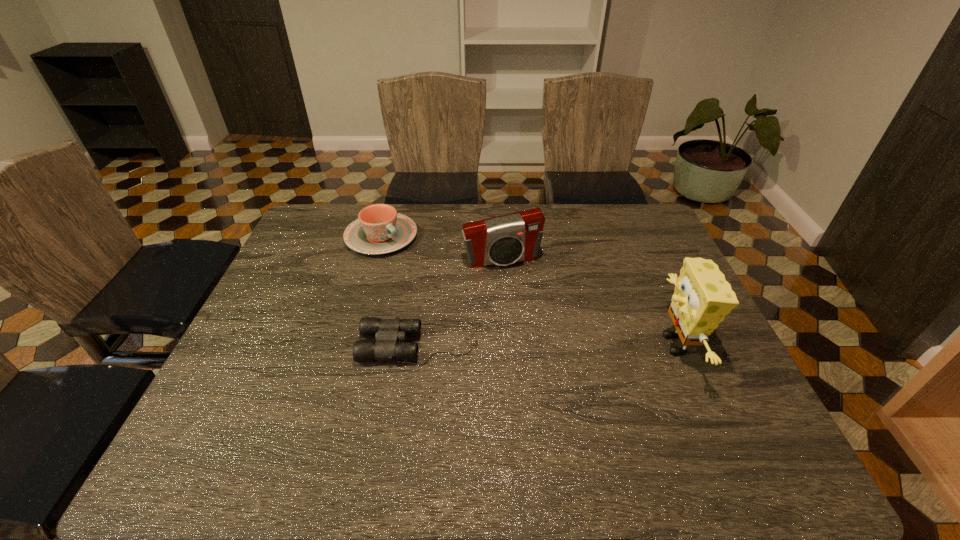
Find the location of `binoculars`. binoculars is located at coordinates (387, 332).

At what (x,y) coordinates should I click in order to perform the action: click on sponge. Please return your answer as a coordinate pair (x, y). Looking at the image, I should click on (702, 298).

I want to click on the rightmost object, so click(702, 298).

Image resolution: width=960 pixels, height=540 pixels. I want to click on the third shortest object, so click(x=503, y=240).

Image resolution: width=960 pixels, height=540 pixels. I want to click on the third tallest object, so click(379, 229).

Locate an element on the screen. The image size is (960, 540). free spot located at the eyepiece of the binoculars is located at coordinates (277, 344).

At what (x,y) coordinates should I click in order to perform the action: click on vacant space located at the eyepiece of the binoculars. Please return your answer as a coordinate pair (x, y). Looking at the image, I should click on (253, 344).

Find the location of a particular element. free space located 0.200m at the eyepiece of the binoculars is located at coordinates (281, 344).

The width and height of the screenshot is (960, 540). I want to click on free space located on the face of the sponge, so click(570, 345).

You are a GUI agent. You are given a task and a screenshot of the screen. Output one action in this format:
    pyautogui.click(x=<x>, y=<y>)
    Task: Click on the vacant area situated 0.240m on the face of the sponge
    This screenshot has width=960, height=540.
    Given the screenshot: What is the action you would take?
    pyautogui.click(x=559, y=345)